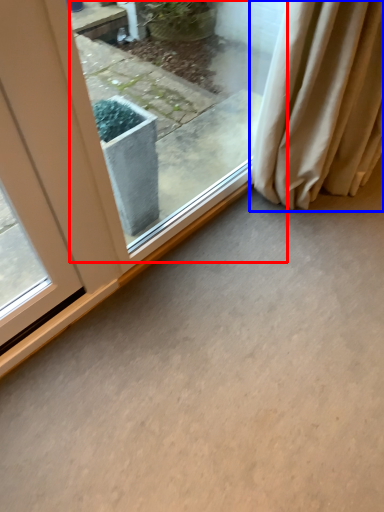
Question: Which object is closer to the camera taking this photo, window (highlighted by a red box) or curtain (highlighted by a blue box)?

Choices:
 (A) window
 (B) curtain

Answer: (A)